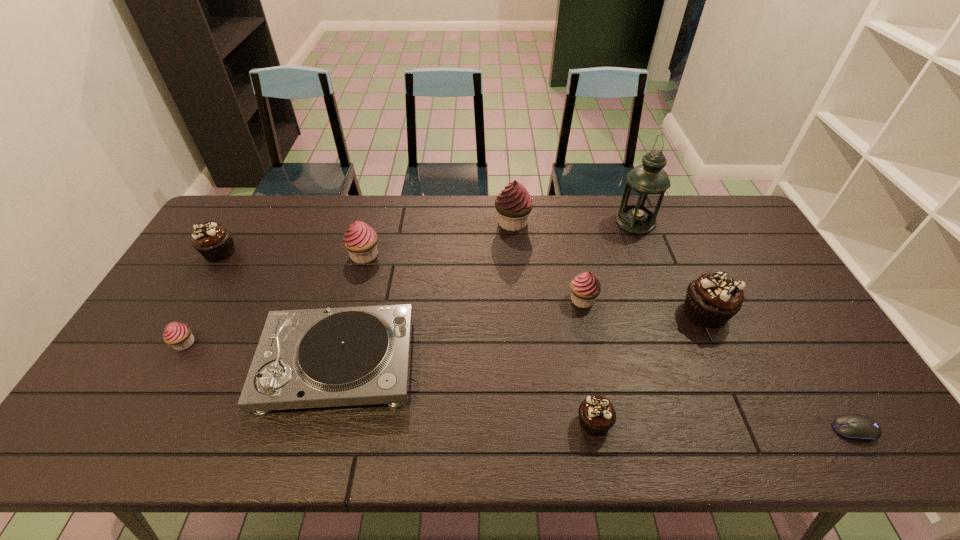
In order to click on the second smallest pink cupcake in this screenshot , I will do `click(585, 288)`.

The height and width of the screenshot is (540, 960). Identify the location of the third farthest pink cupcake. (585, 288).

Locate an element on the screen. record player is located at coordinates (311, 358).

I want to click on the smallest pink cupcake, so coord(178,335).

You are a GUI agent. You are given a task and a screenshot of the screen. Output one action in this format:
    pyautogui.click(x=<x>, y=<y>)
    Task: Click on the second nearest cupcake
    
    Given the screenshot: What is the action you would take?
    pyautogui.click(x=178, y=335)

This screenshot has height=540, width=960. Find the location of `the second brown cupcake from left to right`. the second brown cupcake from left to right is located at coordinates (596, 413).

The width and height of the screenshot is (960, 540). I want to click on the nearest brown cupcake, so click(596, 413).

At what (x,y) coordinates should I click in order to perform the action: click on black computer mouse. Please return your answer as a coordinate pair (x, y). The image size is (960, 540). Looking at the image, I should click on (852, 426).

Locate an element on the screen. This screenshot has height=540, width=960. the rightmost object is located at coordinates (852, 426).

Identify the location of blank area located 0.230m on the front of the tallest object. The image size is (960, 540). pyautogui.click(x=660, y=284).